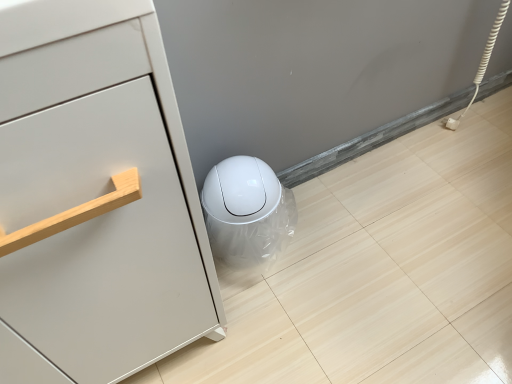
At what (x,y) coordinates should I click in order to perform the action: click on free space to the right of white glossy trash can at lower center. Please return your answer as a coordinate pair (x, y). This screenshot has width=512, height=384. Looking at the image, I should click on (317, 238).